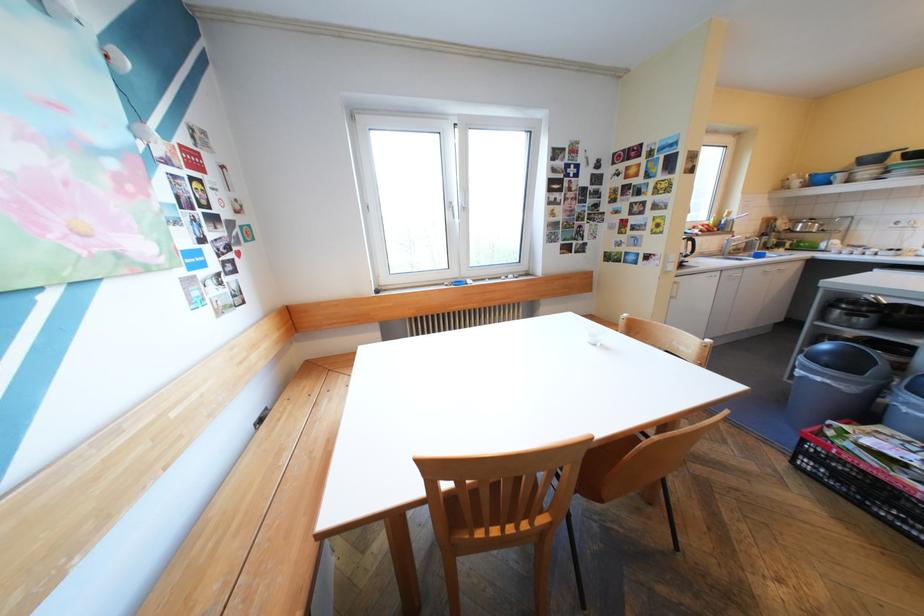
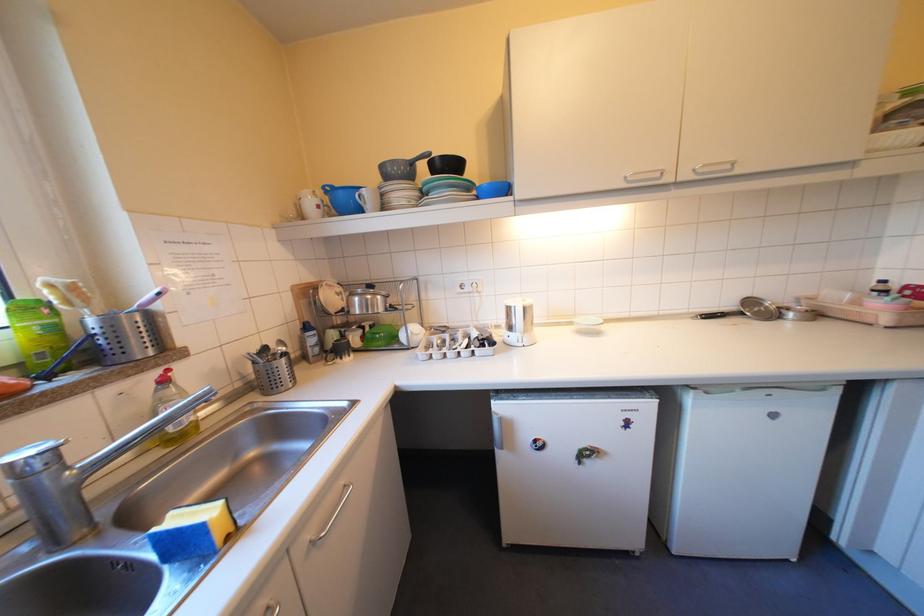
The point at (872, 158) is marked in the first image. Where is the corresponding point in the second image?

(395, 167)